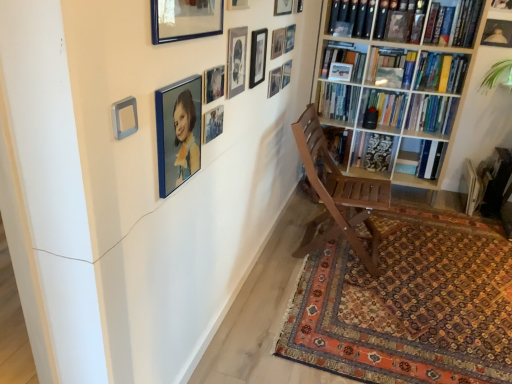
The image size is (512, 384). What are the coordinates of `free point below wooden folding chair at lower right, the 4th book when ordered from top to bottom (from a real-world perspective)` in the screenshot? It's located at (467, 202).